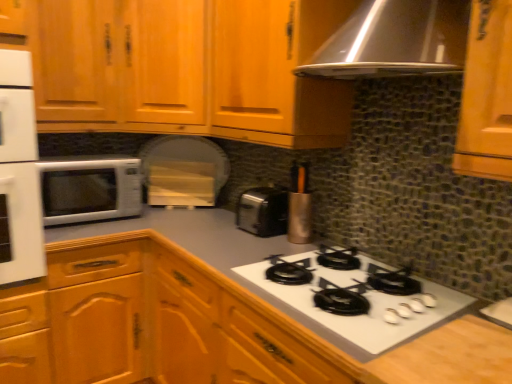
Locate an element on the screen. vacant space to the left of white glossy sink at lower right is located at coordinates (440, 306).